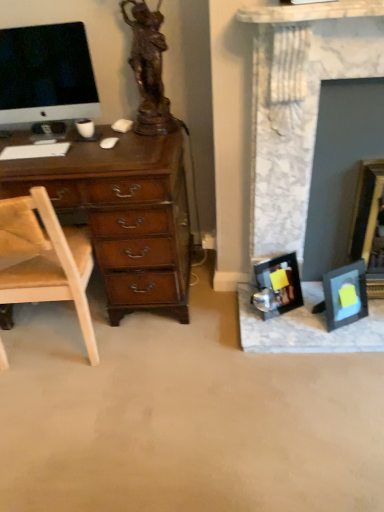
Question: Considering the positions of point (107, 140) and point (130, 1), is point (107, 140) closer or farther from the camera than point (130, 1)?

Choices:
 (A) closer
 (B) farther

Answer: (B)

Question: Is white matte computer mouse at center-left taller or shorter than bronze statue at upper left?

Choices:
 (A) short
 (B) tall

Answer: (A)

Question: Which object is the closest to the satin black monitor at upper left?

Choices:
 (A) matte black picture frame at right, which ranks as the 2th picture frame in left-to-right order
 (B) matte black picture frame at center, arranged as the first picture frame when viewed from the left
 (C) marble fireplace at right
 (D) white matte computer mouse at center-left
 (E) wooden picture frame at right, marked as the 1th picture frame in a right-to-left arrangement

Answer: (D)

Question: Considering the real-world distances, which object is farthest from the tan leather chair at left?

Choices:
 (A) matte black picture frame at right, which ranks as the 2th picture frame in left-to-right order
 (B) bronze statue at upper left
 (C) white matte computer mouse at center-left
 (D) marble fireplace at right
 (E) matte black picture frame at center, arranged as the first picture frame when viewed from the left

Answer: (A)